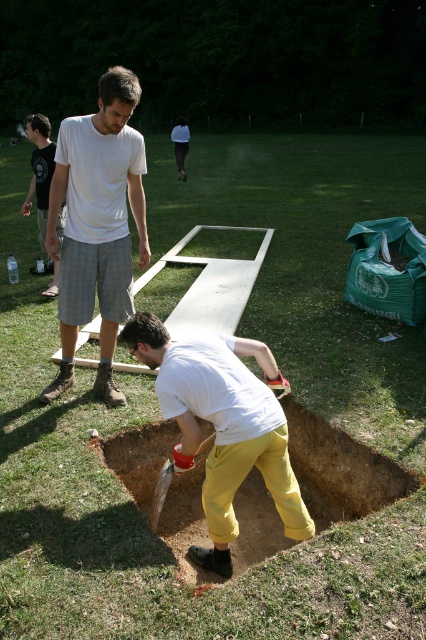
You are standing in the outdoor scene and want to place a small flag exactly halfway between point (143, 212) and point (169, 464). Given that the flag needs to be placed on the ground, will the flag be closer to the camera or further away from the camera compared to the two points?

The flag placed halfway between point (143, 212) and point (169, 464) will be closer to the camera than point (169, 464) but further away than point (143, 212). However, since the question asks whether it is closer or further compared to the two points, the answer depends on which point we are comparing. Since point (143, 212) is closer to the camera than point (169, 464), the midpoint would be between them. Therefore, the flag will be closer to the camera than point (169, 464) but further way

You are standing at the origin point of the coordinate system where the image is projected. The yellow cotton pants at lower center is located at point (222, 426). If you want to move towards the yellow cotton pants at lower center, which direction should you move in terms of the coordinate system?

To move towards the yellow cotton pants at lower center located at point (222, 426), you should move in the positive x and positive y direction since the coordinates are both greater than the origin point at 0,0.